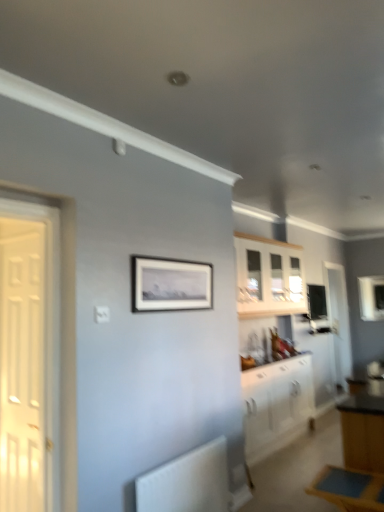
Question: Does white wooden door at left, arranged as the 2th door when viewed from the back, have a lesser height compared to white glossy cabinet at lower right, placed as the second cabinetry when sorted from top to bottom?

Choices:
 (A) yes
 (B) no

Answer: (B)

Question: Does white wooden door at left, arranged as the first door when viewed from the front, appear on the left side of white glossy cabinet at lower right, the 1th cabinetry from the bottom?

Choices:
 (A) yes
 (B) no

Answer: (A)

Question: From the image's perspective, would you say white wooden door at left, arranged as the 2th door when viewed from the back, is positioned over white glossy cabinet at lower right, the 1th cabinetry from the bottom?

Choices:
 (A) yes
 (B) no

Answer: (A)

Question: Does white wooden door at left, arranged as the first door when viewed from the front, turn towards white glossy cabinet at lower right, placed as the second cabinetry when sorted from top to bottom?

Choices:
 (A) yes
 (B) no

Answer: (B)

Question: Does white wooden door at left, arranged as the 2th door when viewed from the back, have a lesser width compared to white glossy cabinet at lower right, the 1th cabinetry from the bottom?

Choices:
 (A) yes
 (B) no

Answer: (A)

Question: Is matte black picture frame at center wider or thinner than white wood cabinet at upper center, which appears as the 1th cabinetry when viewed from the top?

Choices:
 (A) thin
 (B) wide

Answer: (A)

Question: Would you say matte black picture frame at center is to the left or to the right of white wood cabinet at upper center, which appears as the 1th cabinetry when viewed from the top, in the picture?

Choices:
 (A) right
 (B) left

Answer: (B)

Question: From the image's perspective, relative to white wood cabinet at upper center, the second cabinetry when ordered from bottom to top, is matte black picture frame at center above or below?

Choices:
 (A) above
 (B) below

Answer: (A)

Question: Is point [140, 304] closer or farther from the camera than point [266, 261]?

Choices:
 (A) closer
 (B) farther

Answer: (A)

Question: Would you say white matte radiator at lower left is inside or outside white wooden door at left, the first door positioned from the left?

Choices:
 (A) inside
 (B) outside

Answer: (B)

Question: In terms of width, does white matte radiator at lower left look wider or thinner when compared to white wooden door at left, arranged as the first door when viewed from the front?

Choices:
 (A) thin
 (B) wide

Answer: (B)

Question: In the image, is white matte radiator at lower left on the left side or the right side of white wooden door at left, the first door positioned from the left?

Choices:
 (A) right
 (B) left

Answer: (A)

Question: From the image's perspective, is white matte radiator at lower left located above or below white wooden door at left, the first door positioned from the left?

Choices:
 (A) above
 (B) below

Answer: (B)

Question: Considering their positions, is white wooden door at left, which is the second door from right to left, located in front of or behind blue wooden table at lower right?

Choices:
 (A) behind
 (B) front

Answer: (A)

Question: Is point (36, 462) closer or farther from the camera than point (329, 496)?

Choices:
 (A) closer
 (B) farther

Answer: (B)